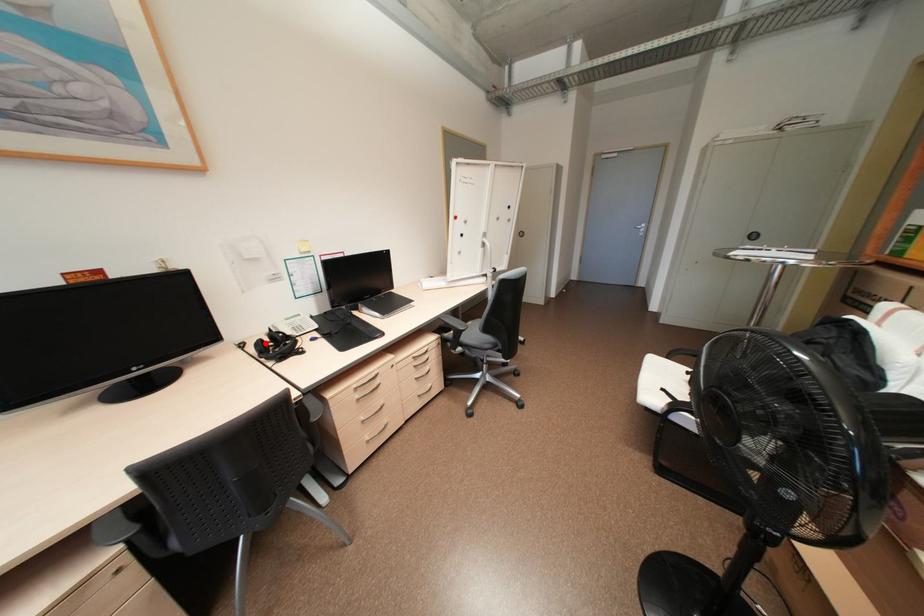
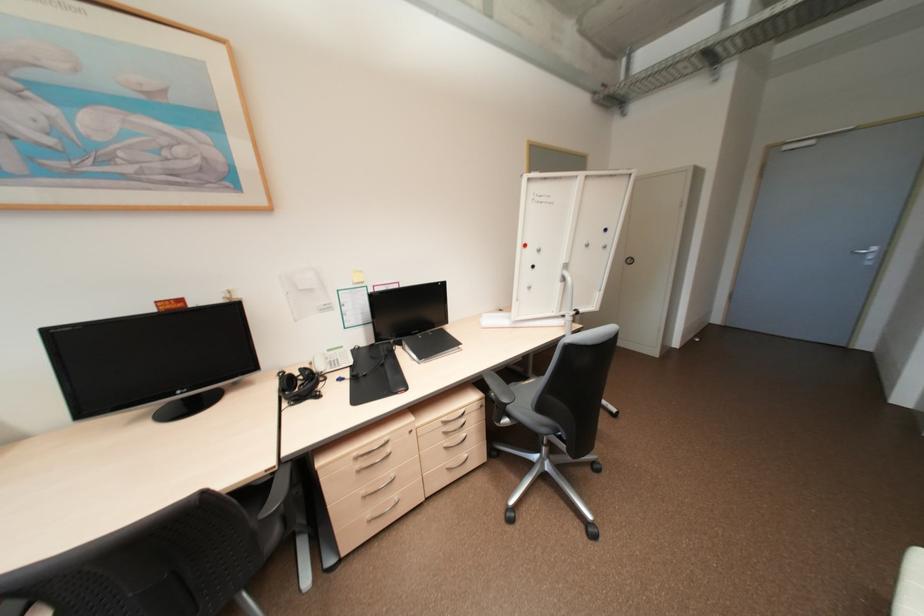
In the second image, find the point that corresponds to the highlighted location in the first image.

(297, 377)